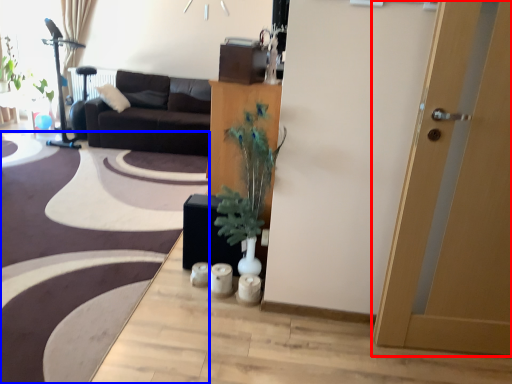
Question: Which object appears farthest to the camera in this image, door (highlighted by a red box) or plain (highlighted by a blue box)?

Choices:
 (A) door
 (B) plain

Answer: (B)